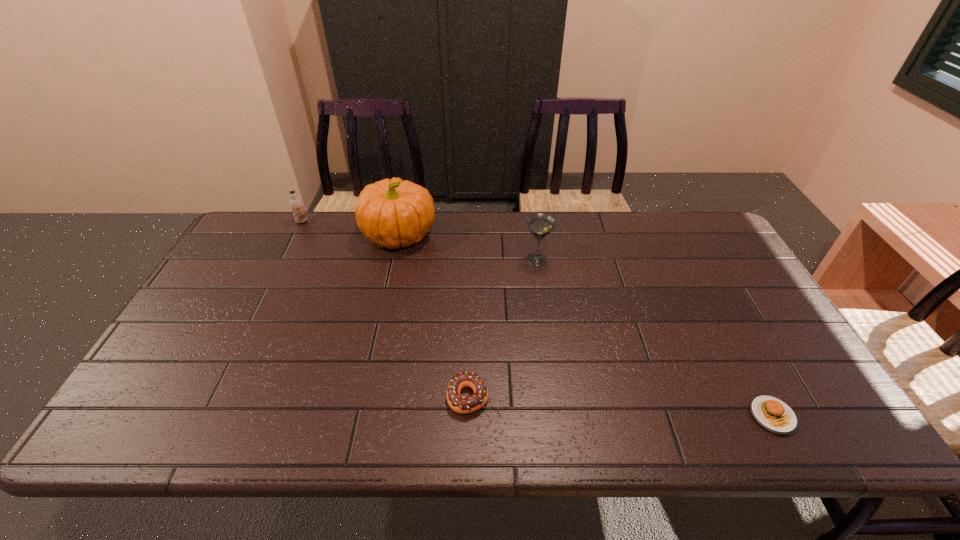
Find the location of a particular element. The width and height of the screenshot is (960, 540). vacant region that satisfies the following two spatial constraints: 1. on the surface of the pumpkin; 2. on the right side of the martini is located at coordinates (395, 260).

I want to click on free space that satisfies the following two spatial constraints: 1. on the front side of the shortest object; 2. on the left side of the chocolate milk, so click(x=205, y=416).

Find the location of a particular element. Image resolution: width=960 pixels, height=540 pixels. free region that satisfies the following two spatial constraints: 1. on the surface of the shortest object; 2. on the left side of the pumpkin is located at coordinates (361, 416).

At what (x,y) coordinates should I click in order to perform the action: click on free spot that satisfies the following two spatial constraints: 1. on the surface of the third object from left to right; 2. on the right side of the fourth object from right to left. Please return your answer as a coordinate pair (x, y). The width and height of the screenshot is (960, 540). Looking at the image, I should click on (365, 397).

This screenshot has height=540, width=960. Find the location of `vacant point that satisfies the following two spatial constraints: 1. on the surface of the third object from left to right; 2. on the left side of the pumpkin`. vacant point that satisfies the following two spatial constraints: 1. on the surface of the third object from left to right; 2. on the left side of the pumpkin is located at coordinates (365, 397).